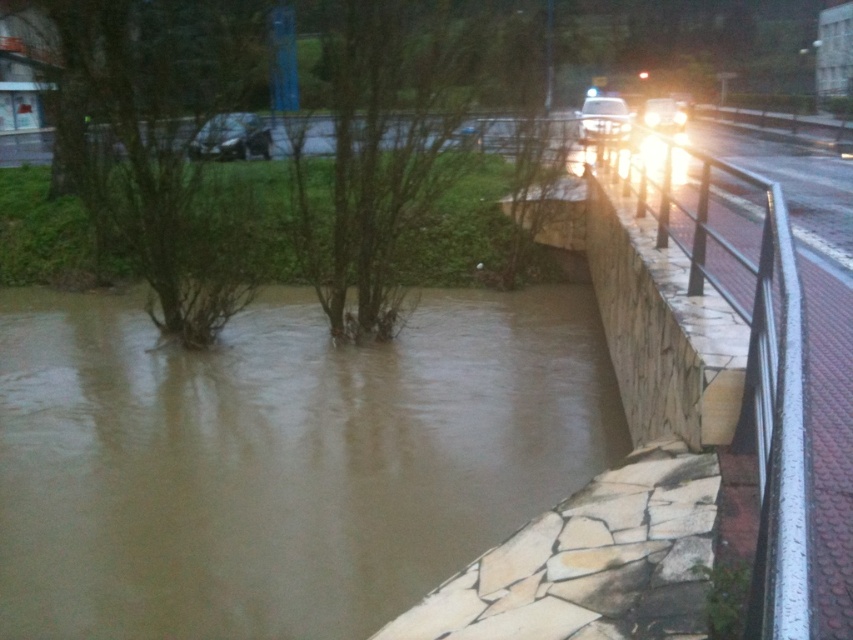
Is brown muddy water at lower left positioned behind white plastic car at upper center?

That is False.

Is brown muddy water at lower left below white plastic car at upper center?

Yes.

What do you see at coordinates (280, 460) in the screenshot? This screenshot has height=640, width=853. I see `brown muddy water at lower left` at bounding box center [280, 460].

Find the location of a particular element. brown muddy water at lower left is located at coordinates (280, 460).

Between point (218, 150) and point (625, 120), which one is positioned behind?

Positioned behind is point (625, 120).

Is metallic silver car at upper left to the right of white plastic car at upper center from the viewer's perspective?

No, metallic silver car at upper left is not to the right of white plastic car at upper center.

What do you see at coordinates (231, 138) in the screenshot? I see `metallic silver car at upper left` at bounding box center [231, 138].

Where is `metallic silver car at upper left`? Image resolution: width=853 pixels, height=640 pixels. metallic silver car at upper left is located at coordinates (231, 138).

Is white plastic car at upper center positioned before shiny silver car at upper center?

Yes, it is in front of shiny silver car at upper center.

Can you confirm if white plastic car at upper center is positioned to the left of shiny silver car at upper center?

Indeed, white plastic car at upper center is positioned on the left side of shiny silver car at upper center.

Does point (601, 109) come behind point (665, 125)?

Yes.

You are a GUI agent. You are given a task and a screenshot of the screen. Output one action in this format:
    pyautogui.click(x=<x>, y=<y>)
    Task: Click on the white plastic car at upper center
    
    Given the screenshot: What is the action you would take?
    pyautogui.click(x=602, y=120)